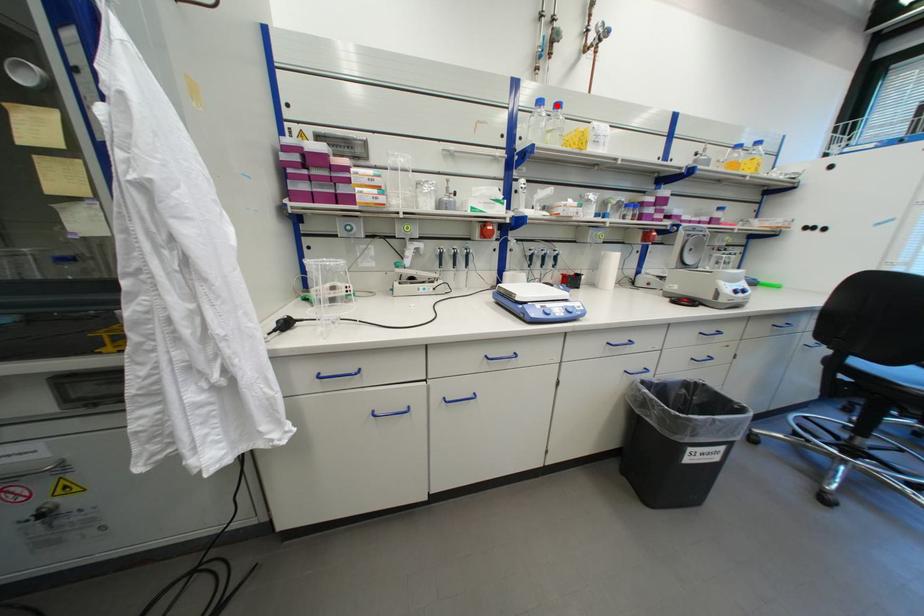
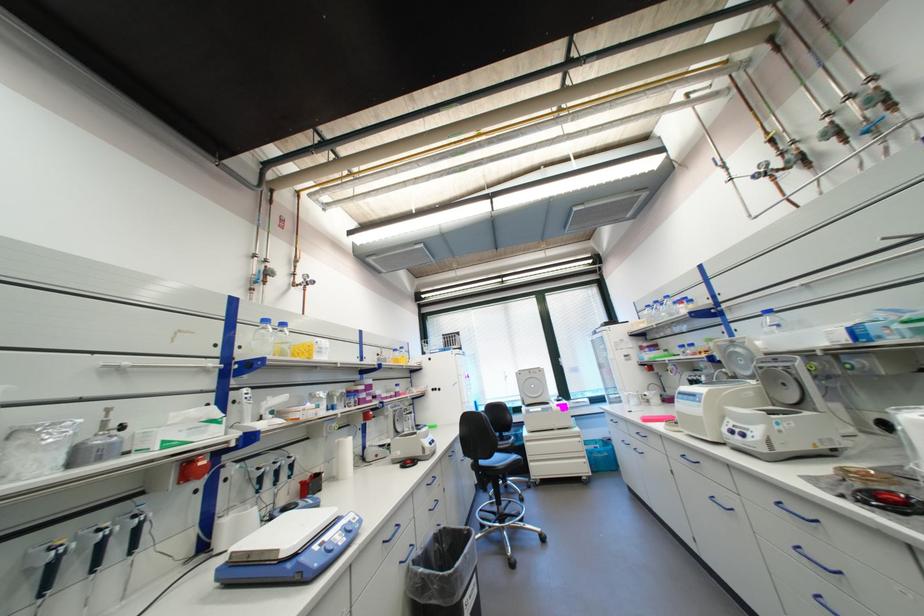
Locate, in the second image, the point that corresponds to the highlighted location in the first image.

(283, 323)